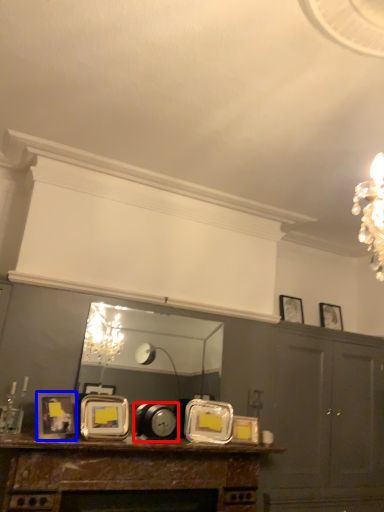
Question: Which point is closer to the camera, alarm clock (highlighted by a red box) or picture frame (highlighted by a blue box)?

Choices:
 (A) alarm clock
 (B) picture frame

Answer: (B)